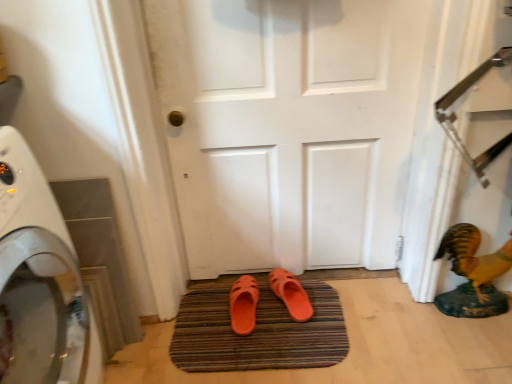
Find the location of a particular element. free spot below shiny gold statue at lower right (from a real-world perspective) is located at coordinates (467, 314).